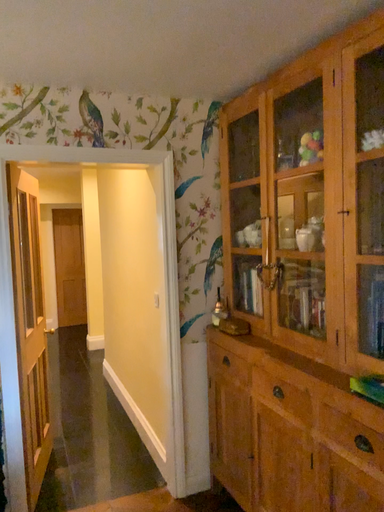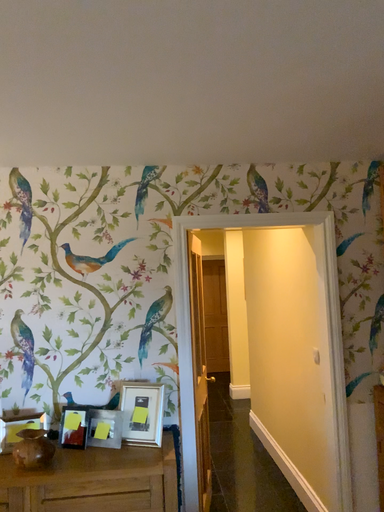
Question: How did the camera likely rotate when shooting the video?

Choices:
 (A) rotated downward
 (B) rotated upward

Answer: (B)